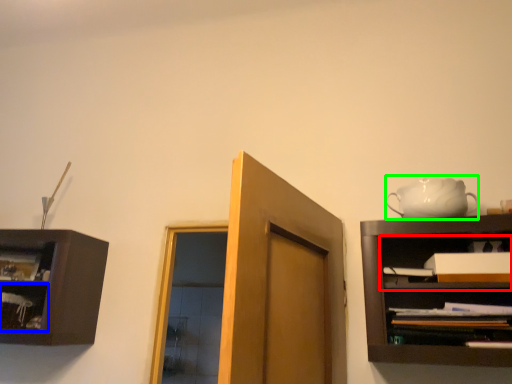
Question: Which is nearer to the cabinet (highlighted by a red box)? shelf (highlighted by a blue box) or tea set (highlighted by a green box).

Choices:
 (A) shelf
 (B) tea set

Answer: (B)